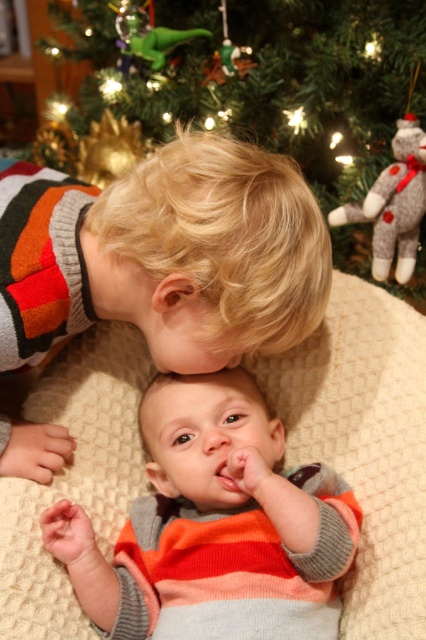
Question: Does striped sweater at center lie behind green matte ornament at upper center?

Choices:
 (A) no
 (B) yes

Answer: (A)

Question: Which object appears closest to the camera in this image?

Choices:
 (A) striped sweater at center
 (B) striped sweater baby at center
 (C) green matte ornament at upper center

Answer: (A)

Question: Is striped sweater at center positioned before green matte ornament at upper center?

Choices:
 (A) yes
 (B) no

Answer: (A)

Question: Among these objects, which one is farthest from the camera?

Choices:
 (A) green matte ornament at upper center
 (B) striped sweater at center
 (C) striped sweater baby at center

Answer: (A)

Question: From the image, what is the correct spatial relationship of striped sweater baby at center in relation to green matte ornament at upper center?

Choices:
 (A) below
 (B) above

Answer: (A)

Question: Which of the following is the farthest from the observer?

Choices:
 (A) green matte ornament at upper center
 (B) striped sweater baby at center

Answer: (A)